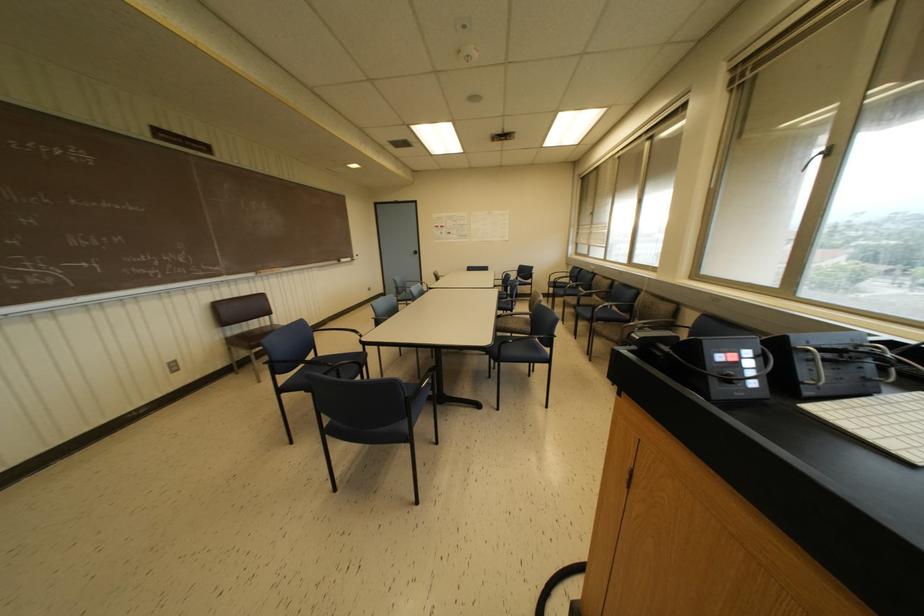
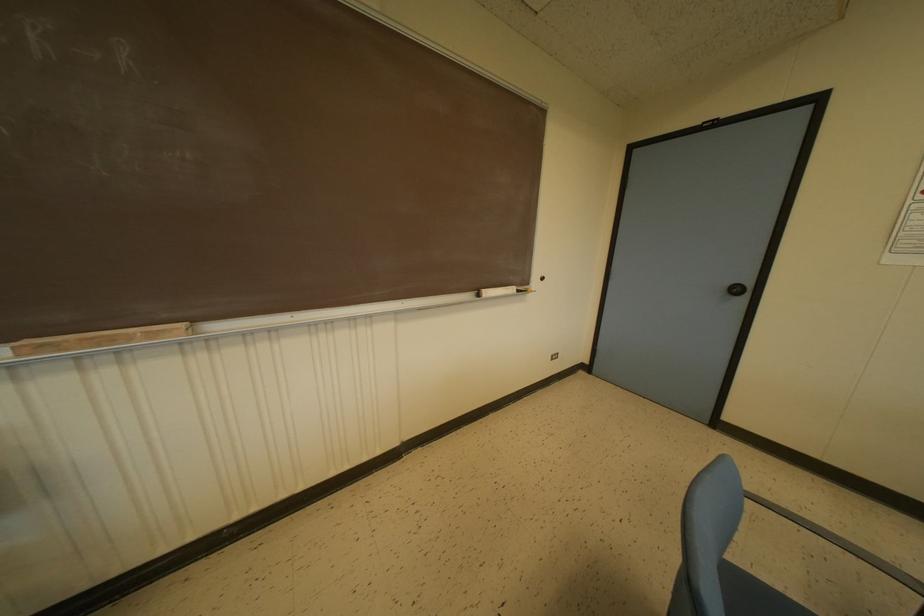
Locate, in the second image, the point that corresponds to point 342,259 in the first image.

(487, 292)